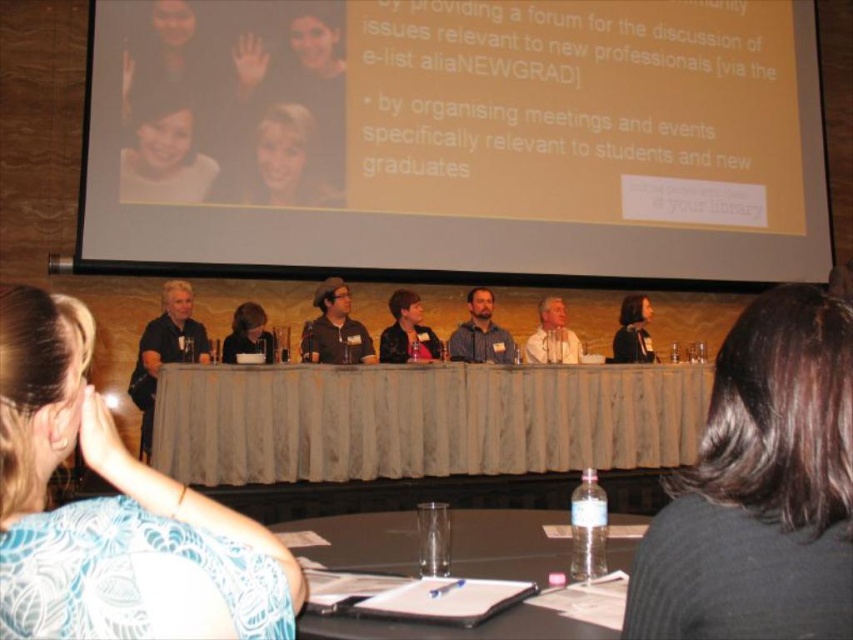
You are attending a panel discussion and notice two presenters at the front. One is wearing a blue printed blouse at center and the other a light beige shirt at center. Which presenter is closer to the camera based on their clothing size?

The blue printed blouse at center has a smaller size compared to light beige shirt at center, so the presenter wearing the light beige shirt at center is closer to the camera since larger objects appear closer.

You are an event coordinator preparing to adjust the seating arrangement. You need to place a new speaker who will sit between the matte yellow projector screen at upper center and the dark brown leather jacket at center. Based on their sizes, which object should the speaker be closer to?

The matte yellow projector screen at upper center has a smaller size compared to the dark brown leather jacket at center. Therefore, the speaker should be closer to the dark brown leather jacket at center to ensure proper visibility and balance in the seating arrangement.